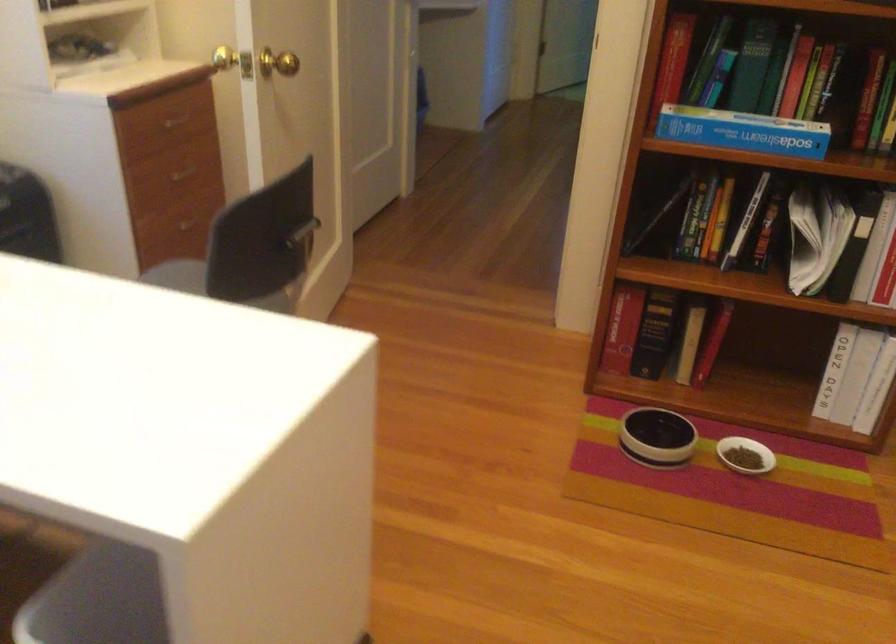
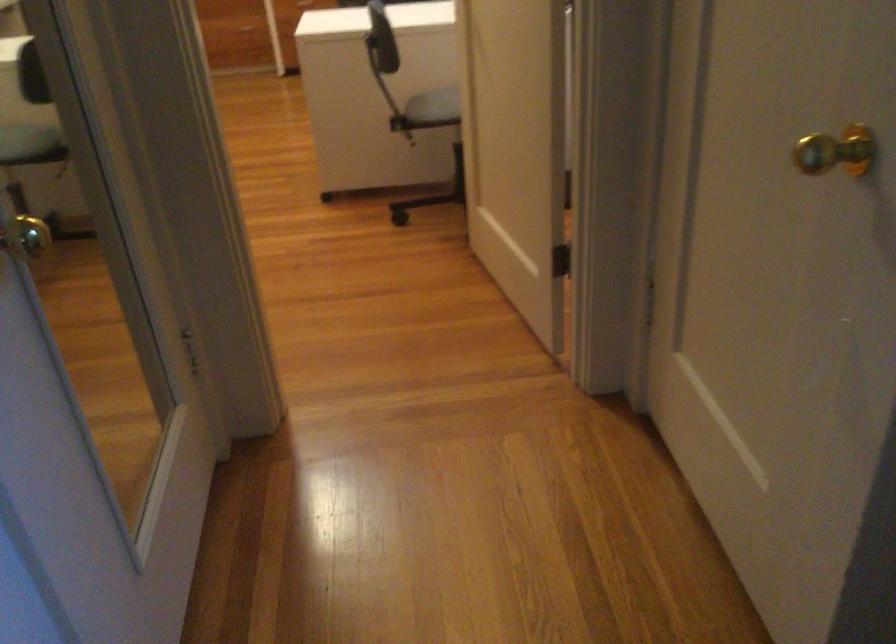
Question: I am providing you with two images of the same scene from different viewpoints. Please identify which objects are invisible in image2.

Choices:
 (A) gold door knob
 (B) black bookend
 (C) black chair armrest
 (D) black and white bowl

Answer: (D)